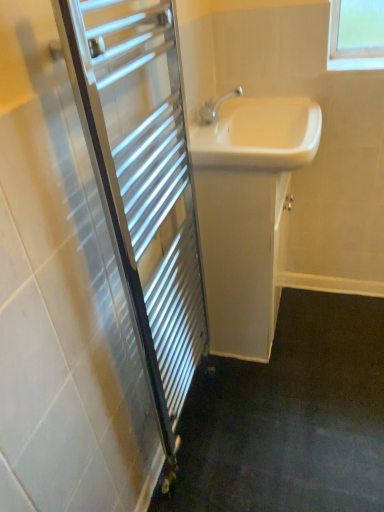
At what (x,y) coordinates should I click in order to perform the action: click on free point in front of white glossy cabinet at center. Please return your answer as a coordinate pair (x, y). Image resolution: width=384 pixels, height=512 pixels. Looking at the image, I should click on (277, 386).